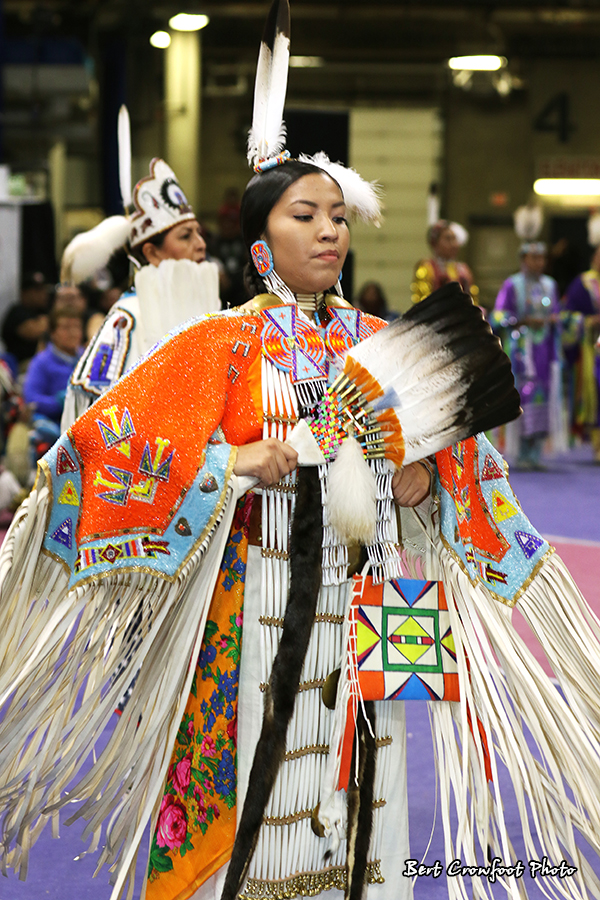
At what (x,y) coordinates should I click in order to perform the action: click on area of purple floor. Please return your answer as a coordinate pair (x, y). Looking at the image, I should click on (562, 496).